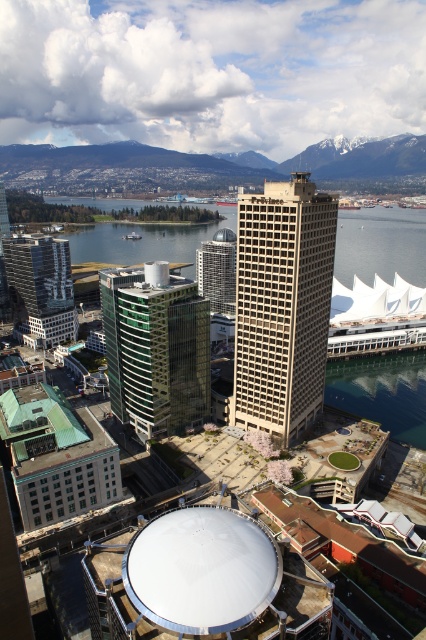
Question: Is green glass building at center wider than matte glass tower at center?

Choices:
 (A) no
 (B) yes

Answer: (B)

Question: Which point is farther to the camera?

Choices:
 (A) green glass building at center
 (B) glassy reflective skyscraper at left
 (C) matte glass tower at center
 (D) beige concrete building at center

Answer: (B)

Question: Can you confirm if beige concrete building at center is smaller than matte glass tower at center?

Choices:
 (A) yes
 (B) no

Answer: (A)

Question: Which is farther from the matte glass tower at center?

Choices:
 (A) green glass building at center
 (B) glassy reflective skyscraper at left

Answer: (B)

Question: Among these objects, which one is nearest to the camera?

Choices:
 (A) green glass building at center
 (B) matte glass tower at center
 (C) beige concrete building at center

Answer: (C)

Question: Is glassy reflective skyscraper at left closer to the viewer compared to matte glass tower at center?

Choices:
 (A) no
 (B) yes

Answer: (A)